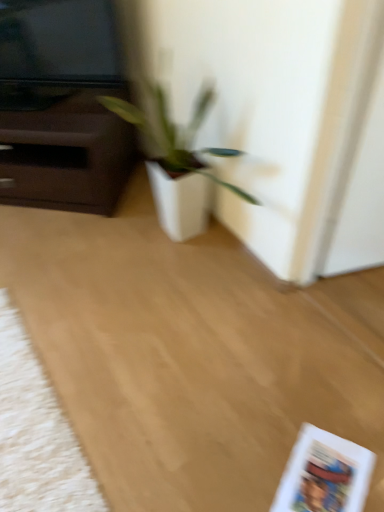
This screenshot has height=512, width=384. In order to click on free spot to the left of white matte pot at center in this screenshot , I will do `click(93, 262)`.